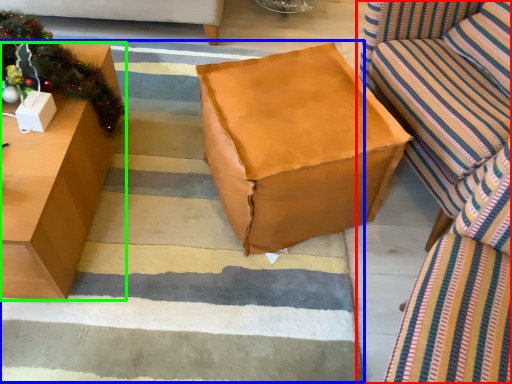
Question: Which object is the farthest from studio couch (highlighted by a red box)? Choose among these: stair (highlighted by a blue box) or table (highlighted by a green box).

Choices:
 (A) stair
 (B) table

Answer: (B)